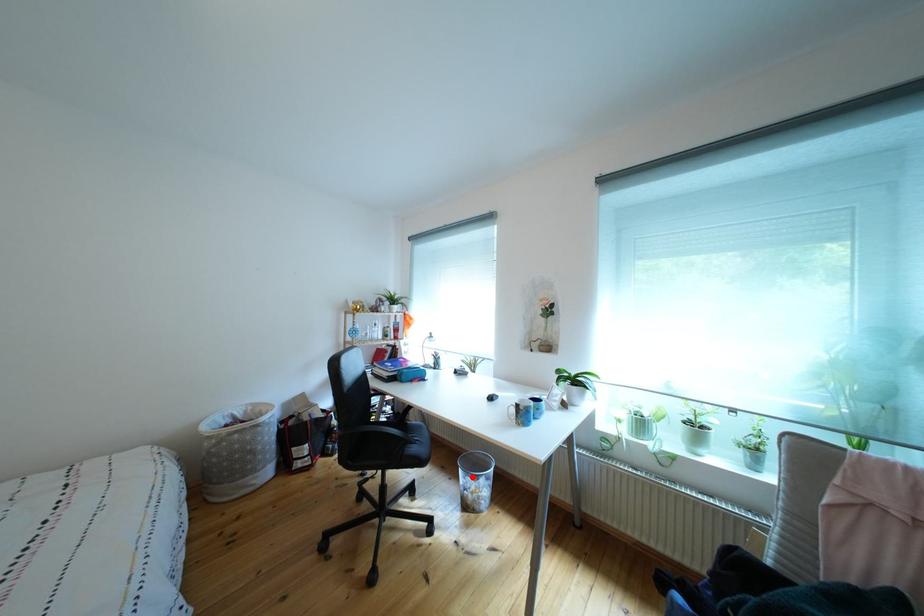
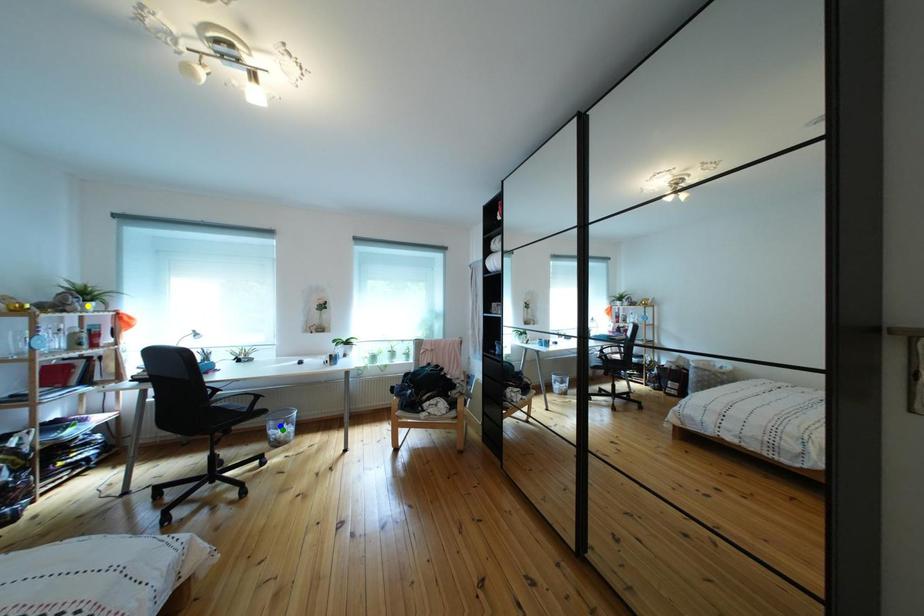
Question: I am providing you with two images of the same scene from different viewpoints. A red point is marked on the first image. You are given multiple points on the second image. Can you choose the point in image 2 that corresponds to the point in image 1?

Choices:
 (A) blue point
 (B) yellow point
 (C) green point

Answer: (C)